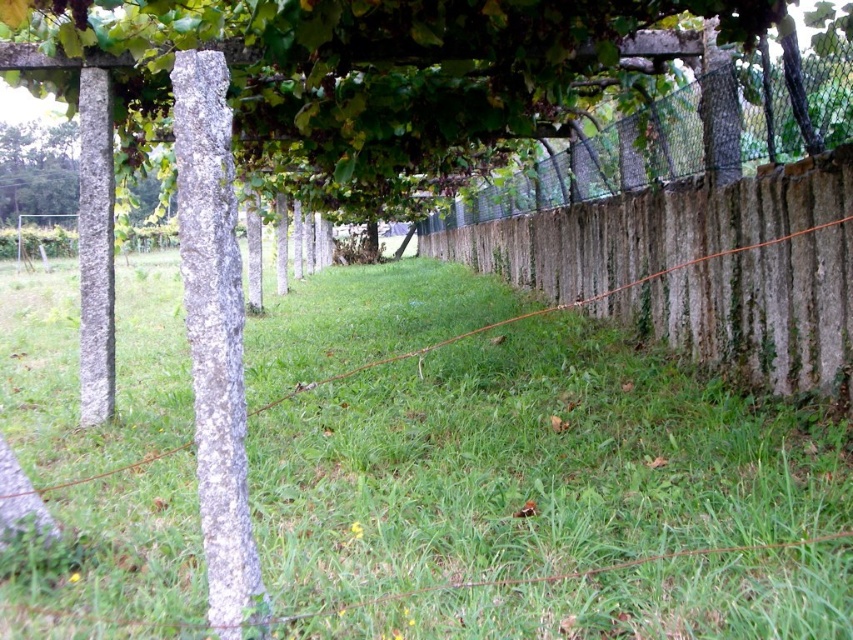
Is point (733, 72) less distant than point (606, 172)?

That is True.

Between point (601, 177) and point (543, 161), which one is positioned behind?

The point (543, 161) is more distant.

What are the coordinates of `green leafy tree at upper center` in the screenshot? It's located at (421, 86).

Image resolution: width=853 pixels, height=640 pixels. What do you see at coordinates (524, 467) in the screenshot?
I see `green grass at center` at bounding box center [524, 467].

Does green grass at center have a larger size compared to rustic wooden fence at center?

Yes.

Which is behind, point (343, 634) or point (641, 144)?

The point (641, 144) is more distant.

This screenshot has width=853, height=640. Find the location of `green grass at center`. green grass at center is located at coordinates click(x=524, y=467).

Can you confirm if green grass at center is wider than green leafy tree at upper center?

Correct, the width of green grass at center exceeds that of green leafy tree at upper center.

Does green grass at center have a smaller size compared to green leafy tree at upper center?

Incorrect, green grass at center is not smaller in size than green leafy tree at upper center.

Which is in front, point (108, 465) or point (358, 211)?

Point (108, 465)

The image size is (853, 640). In order to click on green grass at center in this screenshot , I will do `click(524, 467)`.